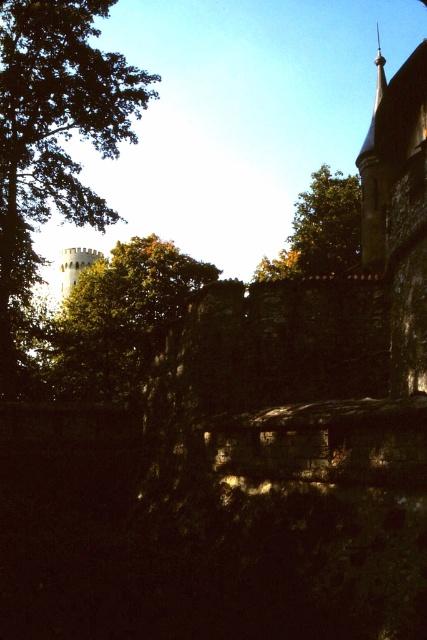
Question: Which object is the closest to the green leafy tree at upper center?

Choices:
 (A) white stone water tower at left
 (B) green leafy tree at upper left
 (C) green leafy tree at left

Answer: (B)

Question: Estimate the real-world distances between objects in this image. Which object is farther from the white stone water tower at left?

Choices:
 (A) green leafy tree at upper left
 (B) green leafy tree at upper center
 (C) green leafy tree at left

Answer: (B)

Question: Is green leafy tree at left bigger than green leafy tree at upper left?

Choices:
 (A) yes
 (B) no

Answer: (A)

Question: Which of the following is the closest to the observer?

Choices:
 (A) green leafy tree at upper left
 (B) white stone water tower at left
 (C) green leafy tree at left

Answer: (A)

Question: Can you confirm if green leafy tree at left is positioned above green leafy tree at upper left?

Choices:
 (A) yes
 (B) no

Answer: (A)

Question: From the image, what is the correct spatial relationship of green leafy tree at upper left in relation to white stone water tower at left?

Choices:
 (A) below
 (B) above

Answer: (A)